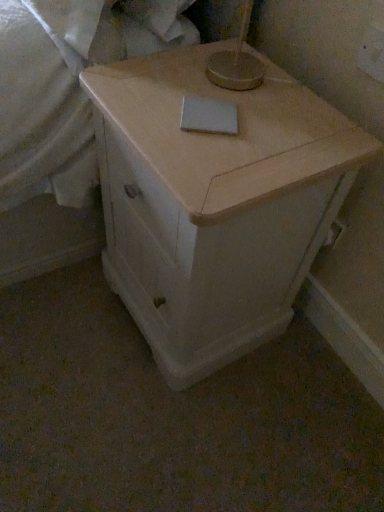
Find the location of a particular element. This screenshot has width=384, height=512. free point behind white matte notepad at center is located at coordinates (220, 73).